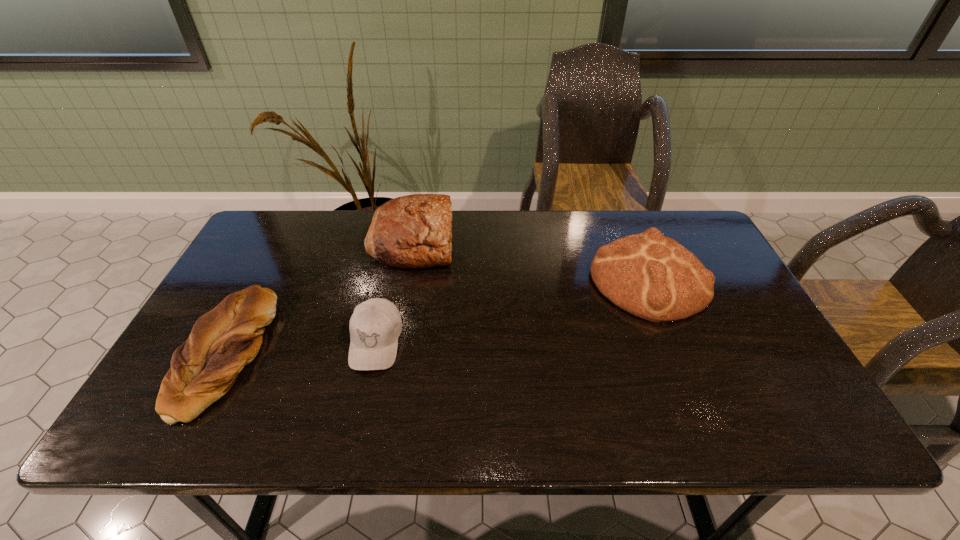
Locate an element on the screen. The image size is (960, 540). free space between the second bread from right to left and the rightmost object is located at coordinates (531, 260).

Locate an element on the screen. This screenshot has height=540, width=960. free space between the leftmost bread and the rightmost object is located at coordinates (436, 317).

This screenshot has height=540, width=960. Identify the location of vacant area that lies between the second bread from right to left and the leftmost object. (318, 297).

Locate an element on the screen. free space that is in between the second bread from left to right and the third shortest object is located at coordinates click(x=531, y=260).

What are the coordinates of `empty space that is in between the second tallest bread and the tallest bread` in the screenshot? It's located at (531, 260).

The width and height of the screenshot is (960, 540). In order to click on free area in between the leftmost bread and the baseball cap in this screenshot , I will do `click(300, 348)`.

I want to click on vacant space that's between the baseball cap and the leftmost object, so click(300, 348).

The width and height of the screenshot is (960, 540). Identify the location of vacant area that lies between the tallest object and the leftmost bread. (318, 297).

Locate an element on the screen. The height and width of the screenshot is (540, 960). vacant space that is in between the third shortest object and the leftmost bread is located at coordinates (436, 317).

Find the location of a particular element. Image resolution: width=960 pixels, height=540 pixels. free space between the rightmost object and the baseball cap is located at coordinates (513, 311).